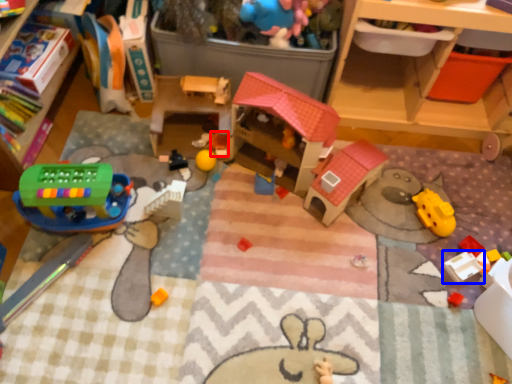
Question: Which point is further to the camera, toy (highlighted by a red box) or toy (highlighted by a blue box)?

Choices:
 (A) toy
 (B) toy

Answer: (A)